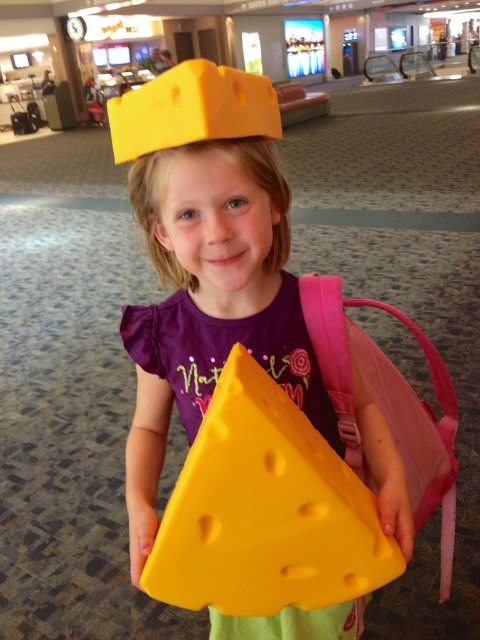
The girl is holding two cheese items. One is a yellow rubbery cheese at center and the other is a matte yellow cheese at center. Which one is lower in position?

The yellow rubbery cheese at center is below the matte yellow cheese at center, so the yellow rubbery cheese at center is lower.

You are an airport security officer who needs to inspect the cheese items a passenger is carrying. The passenger is the girl in the image. Where exactly is the yellow matte cheese at center located in relation to her body?

The yellow matte cheese at center is located at point (206, 262) in 2D coordinates, which corresponds to the center of the girl, likely indicating it is positioned on her head as described in the scene.